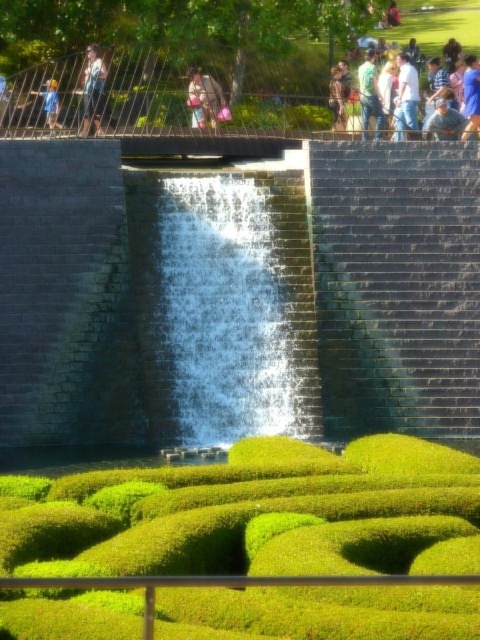
Does point (384, 596) come behind point (381, 365)?

That is False.

Does green leafy hedge at center have a larger size compared to dark gray brick wall at center?

Yes.

Does point (389, 547) lie behind point (312, 262)?

No, (389, 547) is in front of (312, 262).

Locate an element on the screen. green leafy hedge at center is located at coordinates (250, 545).

Who is more forward, (322, 560) or (418, 80)?

Point (322, 560) is in front.

Who is taller, green leafy hedge at center or light brown hair at upper center?

With more height is light brown hair at upper center.

Does point (66, 570) come closer to viewer compared to point (365, 76)?

That is True.

This screenshot has width=480, height=640. What are the coordinates of `green leafy hedge at center` in the screenshot? It's located at (250, 545).

Does denim jacket at upper center have a lesser width compared to light brown wooden stick at upper left?

Yes.

What are the coordinates of `denim jacket at upper center` in the screenshot? It's located at pos(93,92).

Which is in front, point (95, 86) or point (0, 116)?

Positioned in front is point (0, 116).

The height and width of the screenshot is (640, 480). Find the location of `denim jacket at upper center`. denim jacket at upper center is located at coordinates (93, 92).